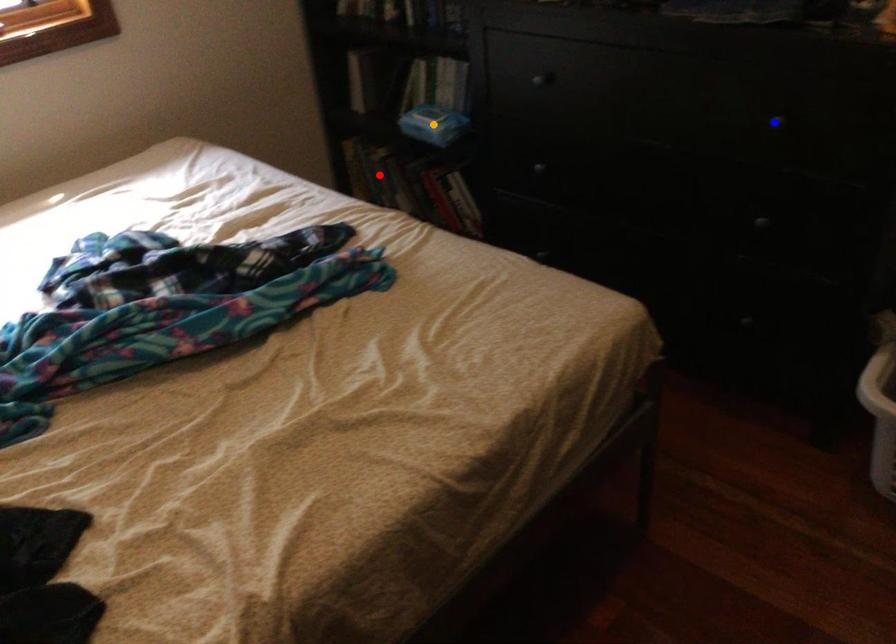
In the scene shown: Order these from nearest to farthest:
- blue point
- orange point
- red point

blue point → orange point → red point